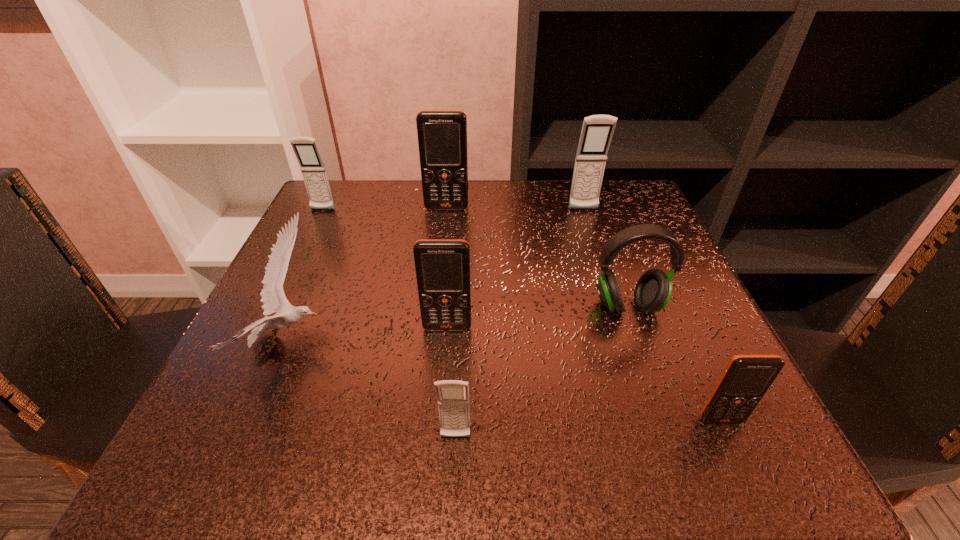
Locate an element on the screen. This screenshot has width=960, height=540. vacant space at the right edge is located at coordinates (629, 342).

Locate an element on the screen. Image resolution: width=960 pixels, height=540 pixels. blank space at the far left corner of the desktop is located at coordinates click(x=363, y=214).

This screenshot has height=540, width=960. In order to click on vacant space at the far right corner of the desktop in this screenshot , I will do point(641,212).

The height and width of the screenshot is (540, 960). What are the coordinates of `vacant space at the near right corner of the desktop` in the screenshot? It's located at [724, 433].

The width and height of the screenshot is (960, 540). I want to click on vacant area between the second biggest gray cellular telephone and the biggest orange cellular telephone, so click(x=385, y=209).

At what (x,y) coordinates should I click in order to perform the action: click on vacant space that's between the second gray cellular telephone from right to left and the black headset. Please return your answer as a coordinate pair (x, y). This screenshot has height=540, width=960. Looking at the image, I should click on (541, 372).

The height and width of the screenshot is (540, 960). Identify the location of free area in between the white gull and the leftmost gray cellular telephone. (305, 275).

The image size is (960, 540). What are the coordinates of `unoccupied position between the biggest orange cellular telephone and the white gull` in the screenshot? It's located at (368, 274).

At what (x,y) coordinates should I click in order to perform the action: click on vacant area between the farthest orange cellular telephone and the leftmost gray cellular telephone. Please return your answer as a coordinate pair (x, y). Looking at the image, I should click on pos(385,209).

Find the location of a particular element. The image size is (960, 540). unoccupied area between the second farthest orange cellular telephone and the smallest orange cellular telephone is located at coordinates point(585,374).